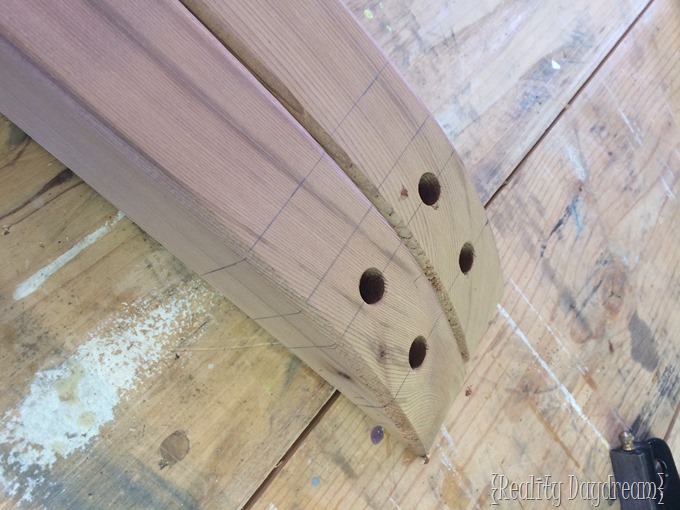
Find the location of `grease stain`. grease stain is located at coordinates (653, 345).